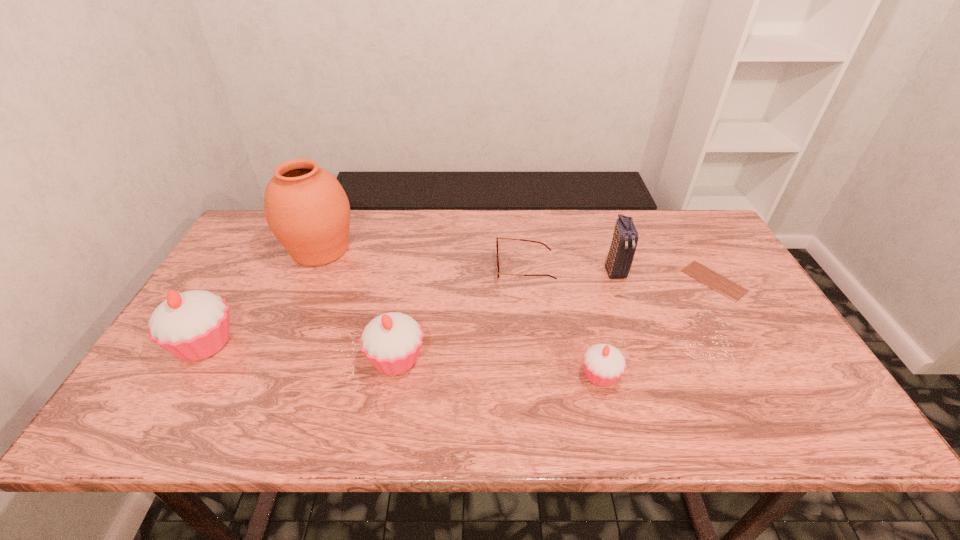
Find the location of `the leftmost cupcake`. the leftmost cupcake is located at coordinates (193, 325).

In order to click on the second tallest cupcake in this screenshot , I will do `click(392, 341)`.

The width and height of the screenshot is (960, 540). What are the coordinates of `the fourth tallest object` in the screenshot? It's located at point(392,341).

Locate an element on the screen. This screenshot has width=960, height=540. the fifth tallest object is located at coordinates (604, 364).

At what (x,y) coordinates should I click in order to perform the action: click on the rightmost cupcake. Please return your answer as a coordinate pair (x, y). This screenshot has height=540, width=960. Looking at the image, I should click on (604, 364).

You are a GUI agent. You are given a task and a screenshot of the screen. Output one action in this format:
    pyautogui.click(x=<x>, y=<y>)
    Task: Click on the clutch bag
    The width and height of the screenshot is (960, 540).
    Given the screenshot: What is the action you would take?
    pyautogui.click(x=621, y=253)

Where is `urn`? This screenshot has height=540, width=960. urn is located at coordinates click(306, 208).

Image resolution: width=960 pixels, height=540 pixels. What are the coordinates of `spectacles` in the screenshot? It's located at (497, 238).

Where is `the fourth object from right to left`? Image resolution: width=960 pixels, height=540 pixels. the fourth object from right to left is located at coordinates (497, 238).

Find the location of `chocolate bar`. chocolate bar is located at coordinates (719, 283).